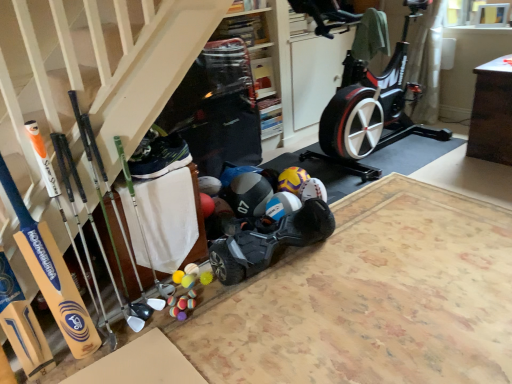
Question: Could wooden stairs at lower left be considered to be inside black matte hoverboard at center?

Choices:
 (A) yes
 (B) no

Answer: (B)

Question: Can you confirm if black matte hoverboard at center is thinner than wooden stairs at lower left?

Choices:
 (A) no
 (B) yes

Answer: (A)

Question: Is black matte hoverboard at center not inside wooden stairs at lower left?

Choices:
 (A) yes
 (B) no

Answer: (A)

Question: From the image's perspective, does black matte hoverboard at center appear lower than wooden stairs at lower left?

Choices:
 (A) no
 (B) yes

Answer: (B)

Question: From a real-world perspective, is black matte hoverboard at center on top of wooden stairs at lower left?

Choices:
 (A) no
 (B) yes

Answer: (A)

Question: Would you say black matte hoverboard at center is to the left or to the right of wooden stairs at lower left in the picture?

Choices:
 (A) right
 (B) left

Answer: (A)

Question: From the image's perspective, is black matte hoverboard at center above or below wooden stairs at lower left?

Choices:
 (A) above
 (B) below

Answer: (B)

Question: Is point (291, 233) positioned closer to the camera than point (6, 134)?

Choices:
 (A) farther
 (B) closer

Answer: (A)

Question: Is black matte hoverboard at center in front of or behind wooden stairs at lower left in the image?

Choices:
 (A) behind
 (B) front

Answer: (A)

Question: From the image's perspective, is black fabric shoe at center above or below wooden stairs at lower left?

Choices:
 (A) below
 (B) above

Answer: (A)

Question: Visually, is black fabric shoe at center positioned to the left or to the right of wooden stairs at lower left?

Choices:
 (A) left
 (B) right

Answer: (A)

Question: Is black fabric shoe at center taller or shorter than wooden stairs at lower left?

Choices:
 (A) short
 (B) tall

Answer: (A)

Question: Choose the correct answer: Is black fabric shoe at center inside wooden stairs at lower left or outside it?

Choices:
 (A) outside
 (B) inside

Answer: (B)

Question: Would you say black matte hoverboard at center is inside or outside blue matte helmet at center?

Choices:
 (A) inside
 (B) outside

Answer: (B)

Question: Is black matte hoverboard at center taller or shorter than blue matte helmet at center?

Choices:
 (A) short
 (B) tall

Answer: (B)